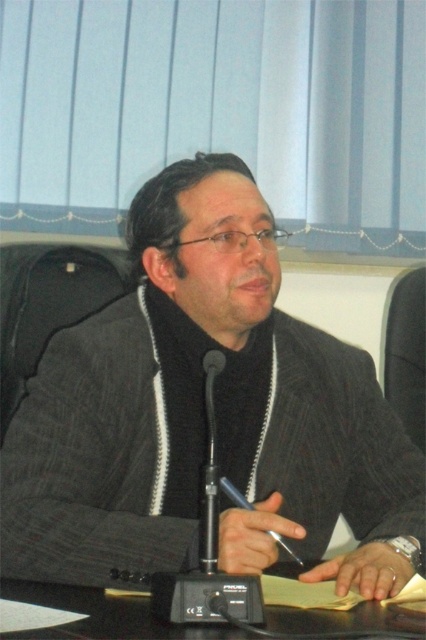
You are organizing a conference and need to place a name tag on the table. The name tag is 10 cm wide. Can you determine if the black glossy table at center has enough space between it and the dark gray textured blazer at center to place the name tag?

The black glossy table at center is behind the dark gray textured blazer at center, so there is sufficient space between them to place the name tag.

From the picture: You are organizing a conference and need to ensure that the dark gray textured blazer at center and the black glossy table at center can fit side by side on a stage. The stage has limited space. Based on the image, can you determine if there is enough space for both items next to each other?

The dark gray textured blazer at center might be wider than black glossy table at center, so there might not be enough space for both items side by side on the stage.